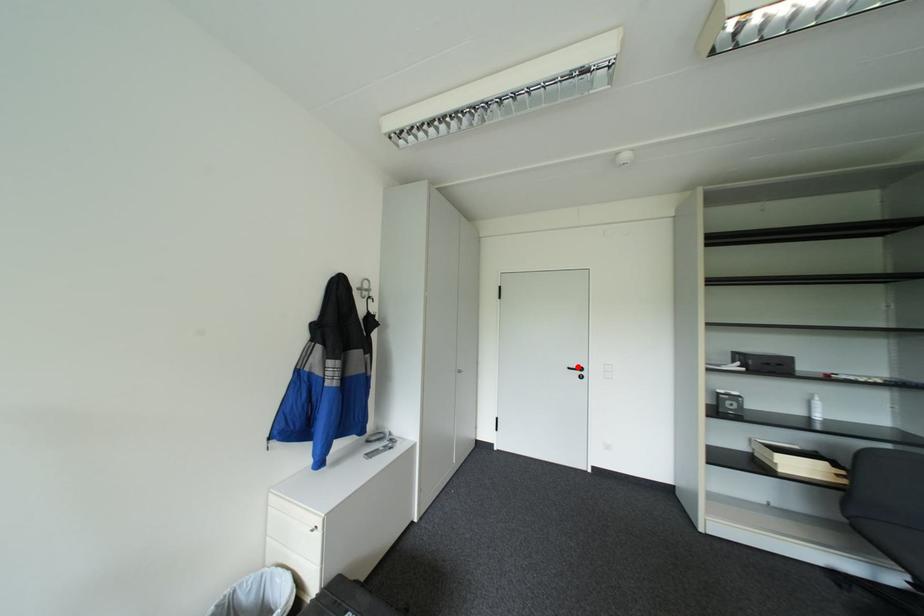
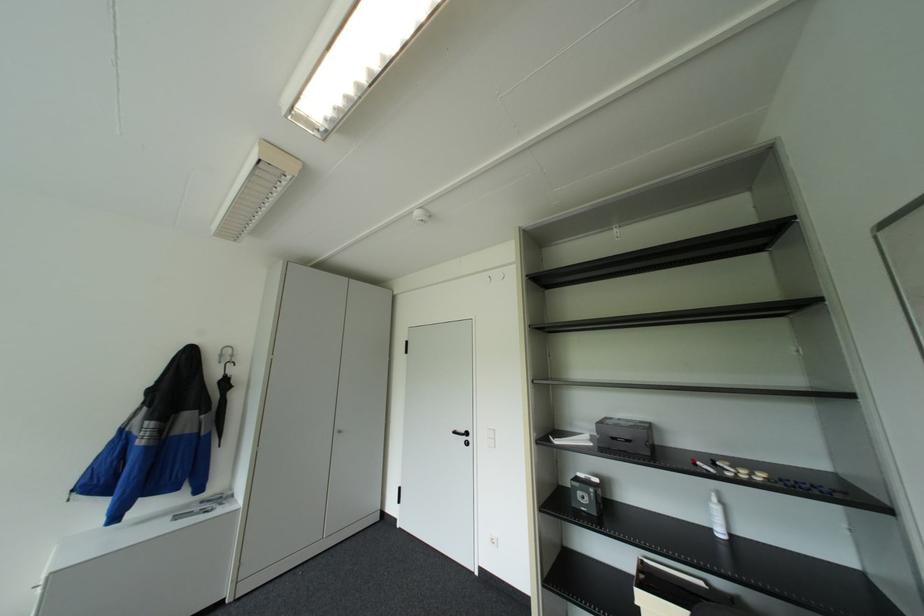
Question: I am providing you with two images of the same scene from different viewpoints. A red point is marked on the first image. At the location where the point appears in image 1, is it still visible in image 2?

Choices:
 (A) Yes
 (B) No

Answer: (A)